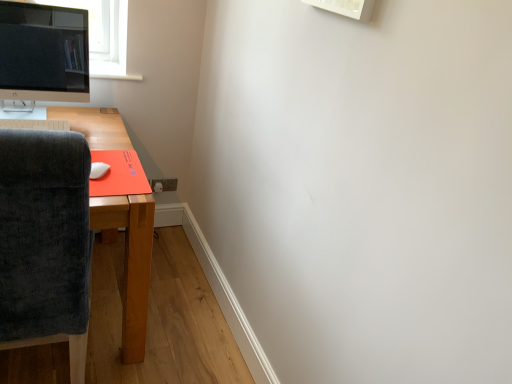
Locate an element on the screen. spots to the right of dark gray fabric chair at left is located at coordinates pos(170,355).